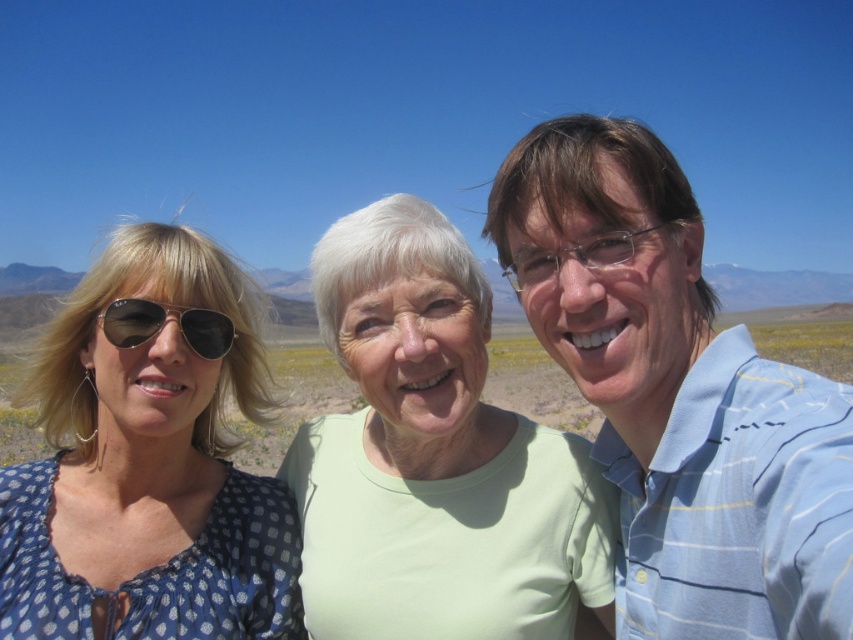
Consider the image. Based on the scene description, where is the light blue striped shirt at right located in terms of its 2D coordinates?

The light blue striped shirt at right is located at the 2D coordinates of point (677, 394).

In the scene shown: You are a photographer setting up a tripod in this desert scene. You have two items to place on your tripod stand, which is 1 meter tall. The items are the light green fabric at center and the matte black goggles at left. Which item can you place on the tripod without it touching the ground?

The light green fabric at center is much taller than the matte black goggles at left. Since the tripod is 1 meter tall, the light green fabric at center may extend beyond the tripod height and touch the ground. The matte black goggles at left are shorter, so placing them on the tripod would keep them above the ground.

You are a photographer positioned at the center of the scene. You want to capture a photo that includes both the light blue striped shirt at right and the matte black goggles at left. Which direction should you move to ensure both subjects are in frame?

Since the light blue striped shirt at right is to the right of the matte black goggles at left, you should move to the left to ensure both subjects are in frame.